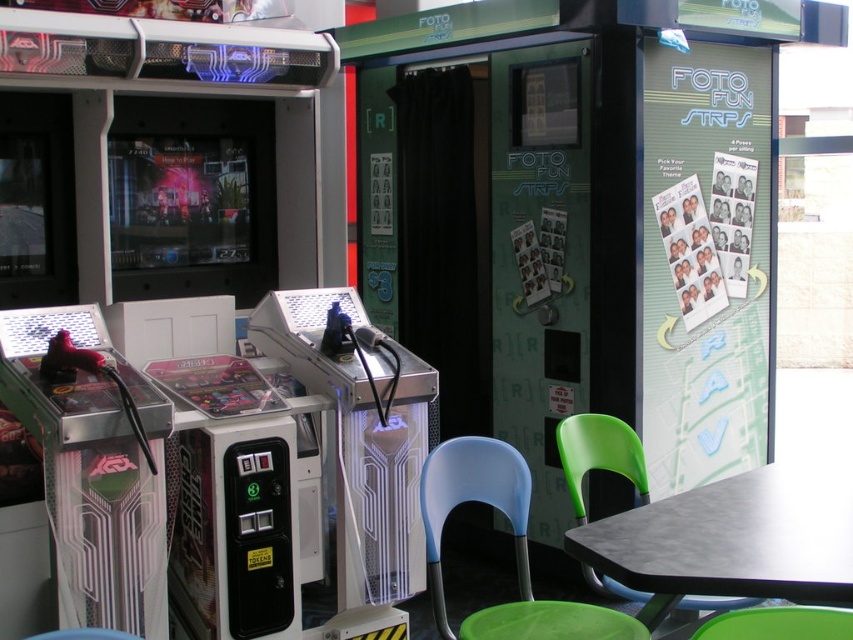
Is black matte table at lower right taller than blue plastic chair at lower center?

In fact, black matte table at lower right may be shorter than blue plastic chair at lower center.

Is black matte table at lower right positioned at the back of blue plastic chair at lower center?

That is False.

Is point (656, 596) positioned before point (502, 493)?

Yes, it is in front of point (502, 493).

Identify the location of black matte table at lower right. The width and height of the screenshot is (853, 640). (734, 538).

Which is more to the left, blue plastic chair at lower center or green plastic chair at lower center?

From the viewer's perspective, blue plastic chair at lower center appears more on the left side.

Is blue plastic chair at lower center thinner than green plastic chair at lower center?

No, blue plastic chair at lower center is not thinner than green plastic chair at lower center.

You are a GUI agent. You are given a task and a screenshot of the screen. Output one action in this format:
    pyautogui.click(x=<x>, y=<y>)
    Task: Click on the blue plastic chair at lower center
    
    Given the screenshot: What is the action you would take?
    pyautogui.click(x=514, y=547)

Between black matte table at lower right and green plastic chair at lower center, which one appears on the left side from the viewer's perspective?

From the viewer's perspective, green plastic chair at lower center appears more on the left side.

Is black matte table at lower right wider than green plastic chair at lower center?

Indeed, black matte table at lower right has a greater width compared to green plastic chair at lower center.

Does point (654, 513) lie in front of point (775, 637)?

No, (654, 513) is further to viewer.

At what (x,y) coordinates should I click in order to perform the action: click on black matte table at lower right. Please return your answer as a coordinate pair (x, y). Image resolution: width=853 pixels, height=640 pixels. Looking at the image, I should click on (734, 538).